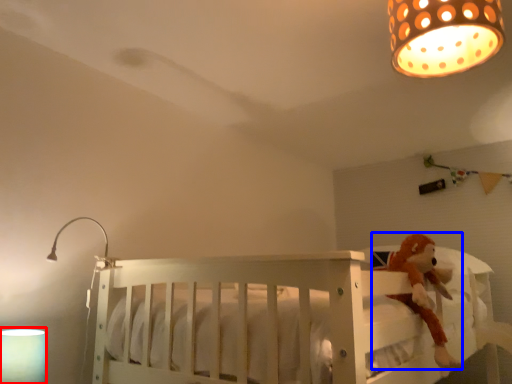
Question: Among these objects, which one is farthest to the camera, lamp (highlighted by a red box) or toy (highlighted by a blue box)?

Choices:
 (A) lamp
 (B) toy

Answer: (B)